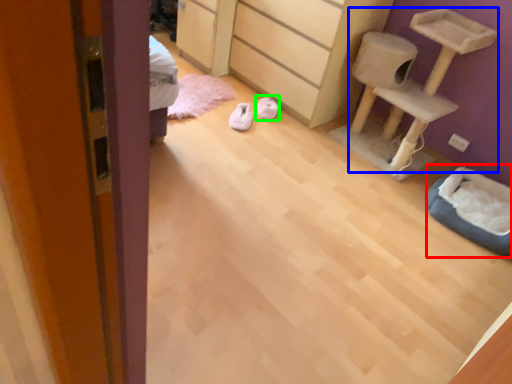
Question: Which is nearer to the cat bed (highlighted by a red box)? furniture (highlighted by a blue box) or footwear (highlighted by a green box).

Choices:
 (A) furniture
 (B) footwear

Answer: (A)